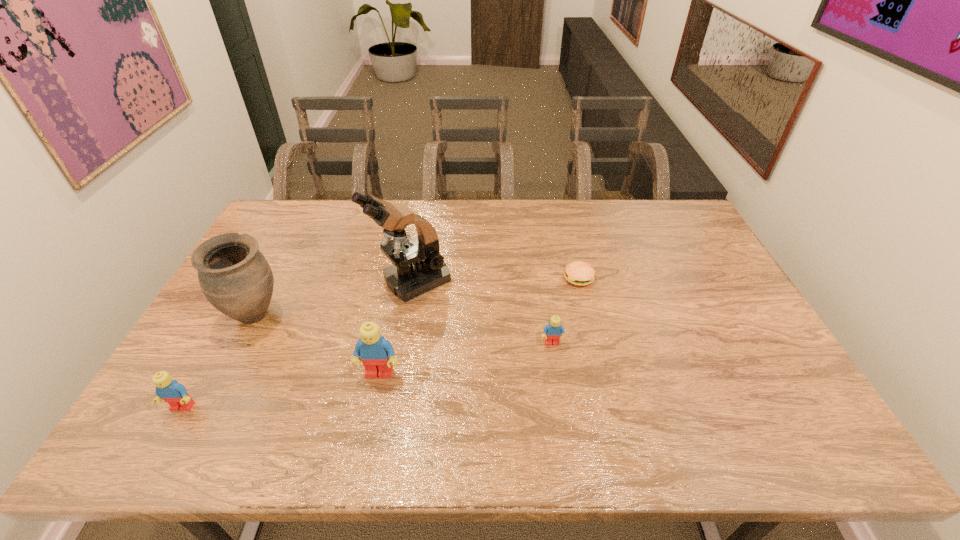
Image resolution: width=960 pixels, height=540 pixels. Find the location of `vacant space located on the face of the third tallest object`. vacant space located on the face of the third tallest object is located at coordinates (372, 407).

Locate an element on the screen. The height and width of the screenshot is (540, 960). vacant space located 0.140m on the face of the fourth farthest object is located at coordinates (560, 393).

In order to click on free spot located 0.240m on the back of the tallest object in this screenshot , I will do click(423, 217).

This screenshot has height=540, width=960. Identify the location of vacant area situated on the back of the patty. (570, 244).

The image size is (960, 540). Find the location of `free spot located on the right of the urn`. free spot located on the right of the urn is located at coordinates (400, 315).

At what (x,y) coordinates should I click in order to perform the action: click on Lego that is at the left edge. Please return your answer as a coordinate pair (x, y). Looking at the image, I should click on (171, 391).

Where is `urn situated at the left edge`? urn situated at the left edge is located at coordinates (235, 277).

The image size is (960, 540). In order to click on object that is at the near left corner in this screenshot , I will do `click(171, 391)`.

Image resolution: width=960 pixels, height=540 pixels. What are the coordinates of `vacant space at the far edge` in the screenshot? It's located at (343, 210).

You are a GUI agent. You are given a task and a screenshot of the screen. Output one action in this format:
    pyautogui.click(x=<x>, y=<y>)
    Task: Click on the vacant space at the near edge of the desktop
    Image resolution: width=960 pixels, height=540 pixels.
    Given the screenshot: What is the action you would take?
    pyautogui.click(x=471, y=404)